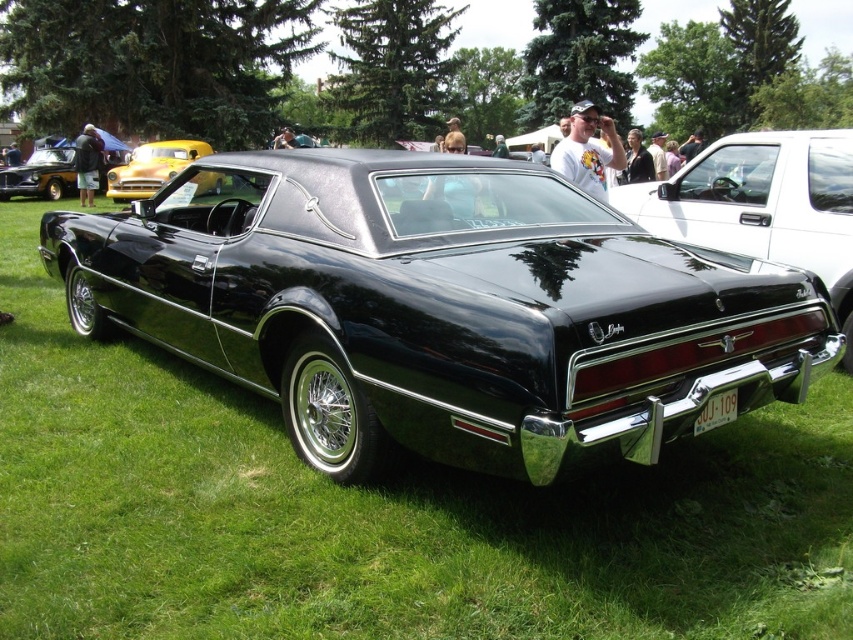
Is point (177, 168) less distant than point (16, 164)?

Yes, it is in front of point (16, 164).

Who is more distant from viewer, (114, 168) or (62, 164)?

Point (62, 164)

Between point (164, 172) and point (32, 193), which one is positioned in front?

Point (164, 172)

Locate an element on the screen. This screenshot has width=853, height=640. yellow glossy car at upper left is located at coordinates pos(151,168).

You are a GUI agent. You are given a task and a screenshot of the screen. Output one action in this format:
    pyautogui.click(x=<x>, y=<y>)
    Task: Click on the glossy black muscle car at center
    The image size is (853, 640).
    Given the screenshot: What is the action you would take?
    (442, 308)

Looking at this image, is glossy black muscle car at center to the right of yellow glossy car at upper left from the viewer's perspective?

Indeed, glossy black muscle car at center is positioned on the right side of yellow glossy car at upper left.

Which is in front, point (296, 284) or point (160, 177)?

Point (296, 284) is in front.

The image size is (853, 640). Identify the location of glossy black muscle car at center. (442, 308).

Which is behind, point (743, 164) or point (21, 179)?

Positioned behind is point (21, 179).

Between point (817, 208) and point (73, 163), which one is positioned behind?

Point (73, 163)

Locate an element on the screen. This screenshot has height=640, width=853. glossy black car at center is located at coordinates (763, 204).